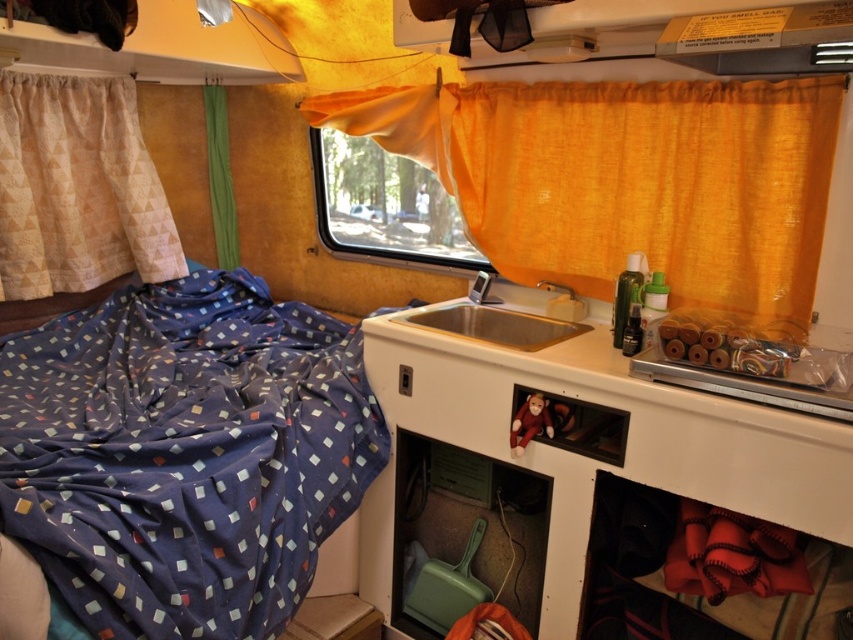
Looking at this image, does blue printed fabric bed at left have a smaller size compared to satin silver sink at center?

No.

Who is more forward, (119, 624) or (526, 348)?

Point (119, 624) is more forward.

Which is in front, point (355, 422) or point (434, 316)?

Point (355, 422)

Where is `blue printed fabric bed at left`? blue printed fabric bed at left is located at coordinates (184, 456).

Can you confirm if orange sheer curtain at upper center is smaller than satin silver sink at center?

Incorrect, orange sheer curtain at upper center is not smaller in size than satin silver sink at center.

Looking at this image, who is higher up, orange sheer curtain at upper center or satin silver sink at center?

Positioned higher is orange sheer curtain at upper center.

Between point (743, 147) and point (524, 349), which one is positioned in front?

Point (524, 349) is more forward.

The width and height of the screenshot is (853, 640). Identify the location of orange sheer curtain at upper center. (628, 180).

Which is above, orange sheer curtain at upper center or beige textured curtain at left?

orange sheer curtain at upper center

Based on the photo, who is more forward, (438, 168) or (57, 228)?

Point (438, 168)

This screenshot has height=640, width=853. I want to click on orange sheer curtain at upper center, so pos(628,180).